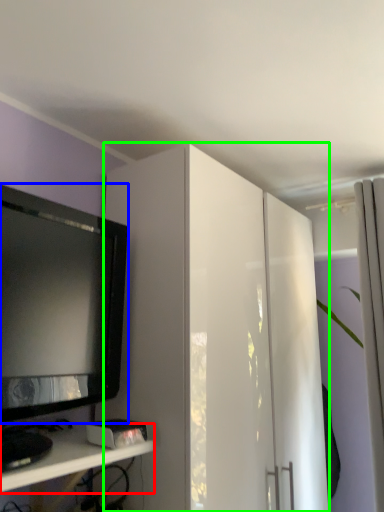
Question: Considering the real-world distances, which object is closest to shelf (highlighted by a red box)? television (highlighted by a blue box) or cabinetry (highlighted by a green box).

Choices:
 (A) television
 (B) cabinetry

Answer: (A)